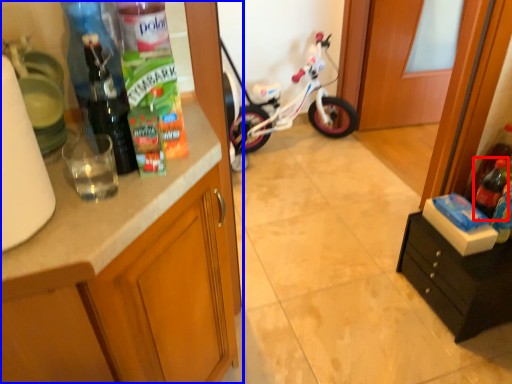
Question: Among these objects, which one is nearest to the camera, bottle (highlighted by a red box) or cabinetry (highlighted by a blue box)?

Choices:
 (A) bottle
 (B) cabinetry

Answer: (B)